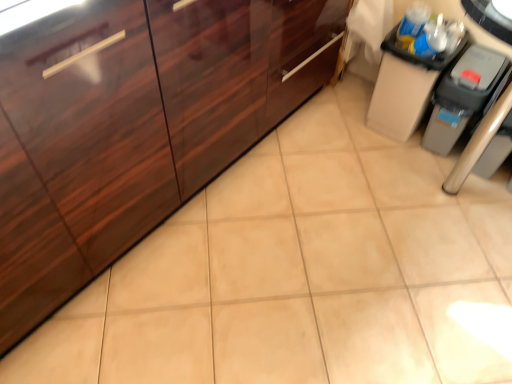
Question: Is glossy wood cabinetry at left, marked as the 1th cabinetry in a left-to-right arrangement, outside of matte black trash can at upper right, acting as the 2th cabinetry starting from the left?

Choices:
 (A) no
 (B) yes

Answer: (B)

Question: From the image's perspective, is glossy wood cabinetry at left, marked as the 1th cabinetry in a left-to-right arrangement, above matte black trash can at upper right, acting as the 2th cabinetry starting from the left?

Choices:
 (A) yes
 (B) no

Answer: (B)

Question: Can you confirm if glossy wood cabinetry at left, the second cabinetry in the right-to-left sequence, is taller than matte black trash can at upper right, positioned as the 1th cabinetry in right-to-left order?

Choices:
 (A) no
 (B) yes

Answer: (B)

Question: Is glossy wood cabinetry at left, marked as the 1th cabinetry in a left-to-right arrangement, turned away from matte black trash can at upper right, acting as the 2th cabinetry starting from the left?

Choices:
 (A) no
 (B) yes

Answer: (A)

Question: Is glossy wood cabinetry at left, the second cabinetry in the right-to-left sequence, wider than matte black trash can at upper right, positioned as the 1th cabinetry in right-to-left order?

Choices:
 (A) no
 (B) yes

Answer: (B)

Question: From their relative heights in the image, would you say glossy wood cabinetry at left, the second cabinetry in the right-to-left sequence, is taller or shorter than matte black trash can at upper right, acting as the 2th cabinetry starting from the left?

Choices:
 (A) tall
 (B) short

Answer: (A)

Question: From the image's perspective, relative to matte black trash can at upper right, positioned as the 1th cabinetry in right-to-left order, is glossy wood cabinetry at left, marked as the 1th cabinetry in a left-to-right arrangement, above or below?

Choices:
 (A) above
 (B) below

Answer: (B)

Question: Is glossy wood cabinetry at left, the second cabinetry in the right-to-left sequence, in front of or behind matte black trash can at upper right, acting as the 2th cabinetry starting from the left, in the image?

Choices:
 (A) front
 (B) behind

Answer: (A)

Question: Is point (10, 238) closer or farther from the camera than point (387, 129)?

Choices:
 (A) closer
 (B) farther

Answer: (A)

Question: Does point (436, 94) appear closer or farther from the camera than point (44, 240)?

Choices:
 (A) farther
 (B) closer

Answer: (A)

Question: From their relative heights in the image, would you say gray plastic trash can at right is taller or shorter than glossy wood cabinetry at left, marked as the 1th cabinetry in a left-to-right arrangement?

Choices:
 (A) tall
 (B) short

Answer: (B)

Question: From the image's perspective, relative to glossy wood cabinetry at left, marked as the 1th cabinetry in a left-to-right arrangement, is gray plastic trash can at right above or below?

Choices:
 (A) below
 (B) above

Answer: (A)

Question: Visually, is gray plastic trash can at right positioned to the left or to the right of glossy wood cabinetry at left, the second cabinetry in the right-to-left sequence?

Choices:
 (A) left
 (B) right

Answer: (B)

Question: Is matte black trash can at upper right, acting as the 2th cabinetry starting from the left, taller or shorter than glossy wood cabinetry at left, the second cabinetry in the right-to-left sequence?

Choices:
 (A) short
 (B) tall

Answer: (A)

Question: Relative to glossy wood cabinetry at left, marked as the 1th cabinetry in a left-to-right arrangement, is matte black trash can at upper right, positioned as the 1th cabinetry in right-to-left order, in front or behind?

Choices:
 (A) front
 (B) behind

Answer: (B)